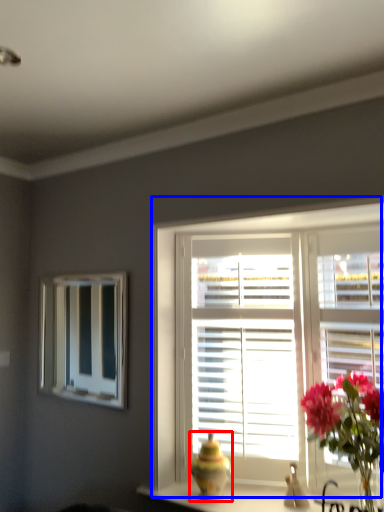
Question: Which point is further to the camera, vase (highlighted by a red box) or window (highlighted by a blue box)?

Choices:
 (A) vase
 (B) window

Answer: (A)